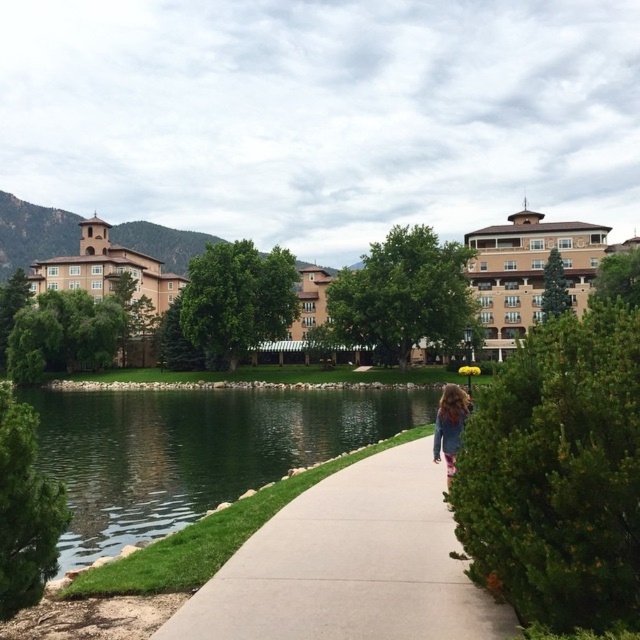
You are a delivery person carrying a package and need to walk along the smooth concrete sidewalk at center while avoiding the denim jacket at center. Is the sidewalk wide enough for you to walk around the jacket without stepping onto the grass?

The smooth concrete sidewalk at center has a smaller size compared to denim jacket at center, so the sidewalk may not be wide enough to walk around the jacket without stepping onto the grass.

You are a gardener standing on the smooth concrete sidewalk at center and want to reach the green liquid water at lower left to collect some samples. Can you step directly from the sidewalk onto the water without any obstacles?

The smooth concrete sidewalk at center has a lesser height compared to green liquid water at lower left, so stepping directly from the sidewalk onto the water might not be possible due to the elevation difference.

You are a gardener standing on the smooth concrete sidewalk at center and want to reach the green liquid water at lower left to water some plants. Which direction should you walk to get closer to the water?

The smooth concrete sidewalk at center is to the right of green liquid water at lower left, so you should walk to the left to get closer to the green liquid water at lower left.